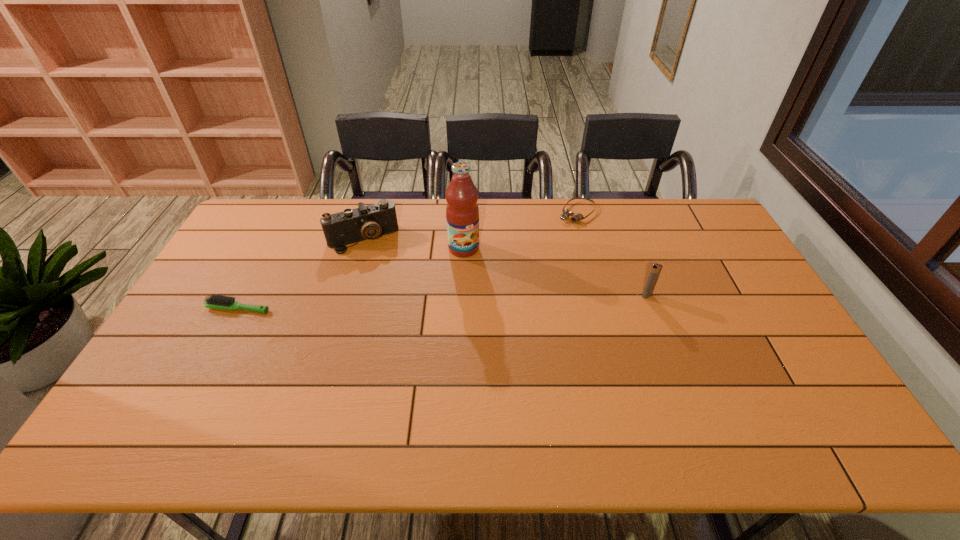
Image resolution: width=960 pixels, height=540 pixels. Find the location of `free space that satisfies the following two spatial constraints: 1. on the front side of the second nearest object; 2. on the left side of the camera`. free space that satisfies the following two spatial constraints: 1. on the front side of the second nearest object; 2. on the left side of the camera is located at coordinates (346, 295).